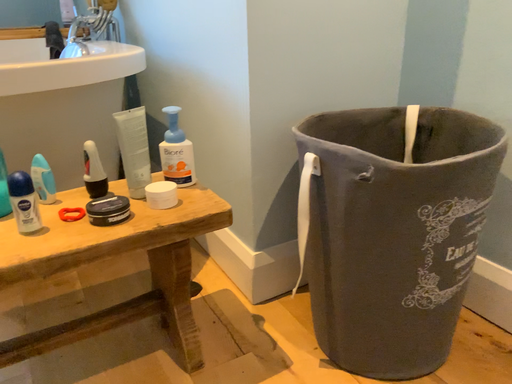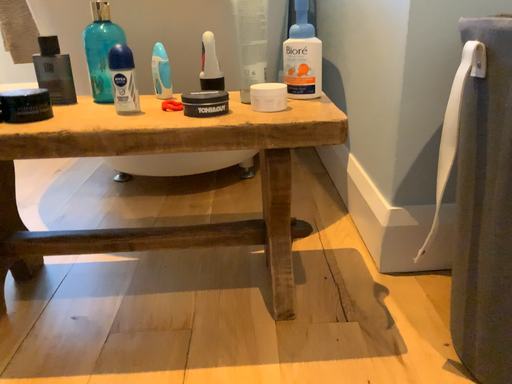
Question: Which way did the camera rotate in the video?

Choices:
 (A) rotated left
 (B) rotated right

Answer: (A)